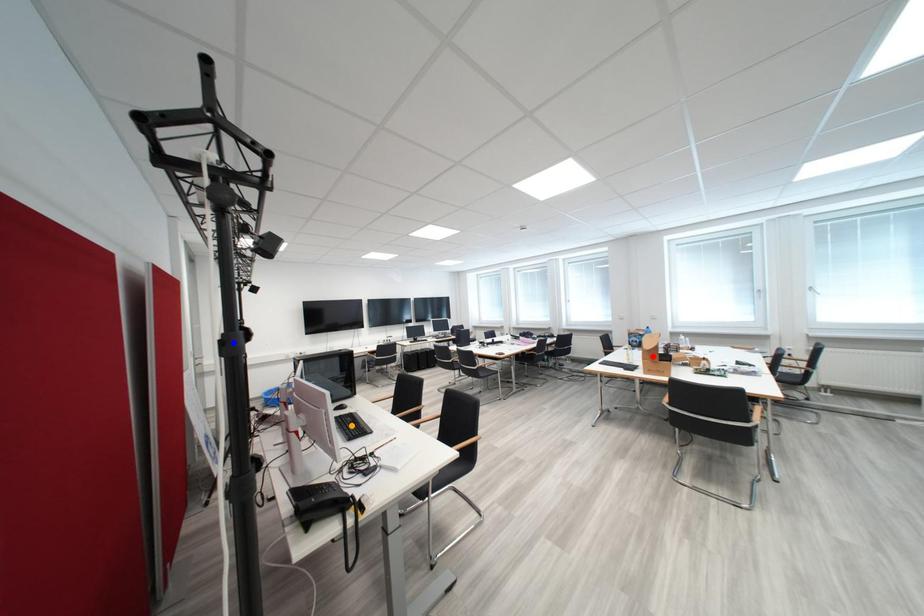
Order these from nearest to farthest:
- blue point
- orange point
- red point

blue point < orange point < red point